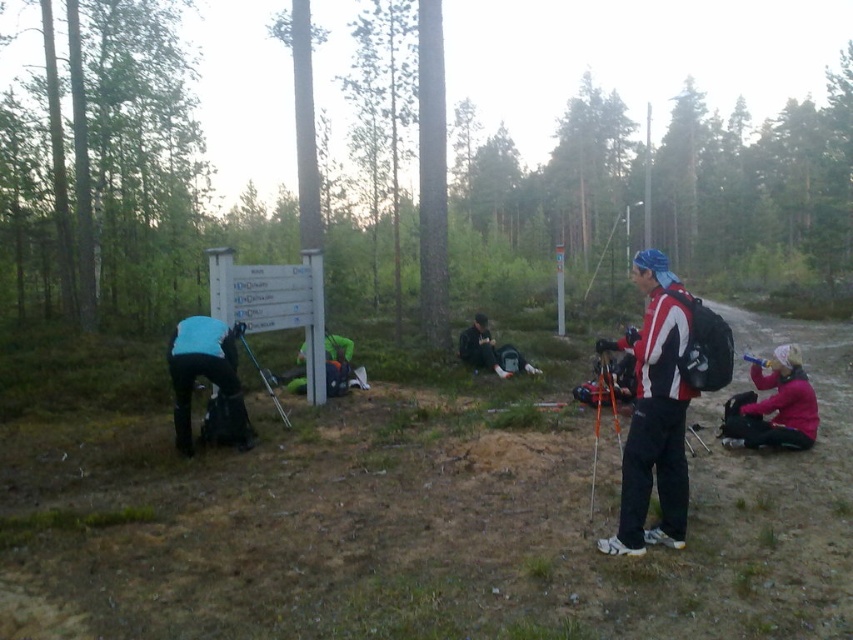
Question: Which of these objects is positioned closest to the metallic silver ski pole at lower center?

Choices:
 (A) pink fleece jacket at lower right
 (B) neon green jacket at center
 (C) red and white ski jacket at right
 (D) blue fabric skier at left

Answer: (D)

Question: Observing the image, what is the correct spatial positioning of neon green jacket at center in reference to metallic silver ski pole at lower center?

Choices:
 (A) above
 (B) below

Answer: (A)

Question: Does green grass at center come in front of blue fabric skier at left?

Choices:
 (A) no
 (B) yes

Answer: (A)

Question: Which object appears farthest from the camera in this image?

Choices:
 (A) neon green jacket at center
 (B) green grass at center

Answer: (B)

Question: Which point is closer to the camera?

Choices:
 (A) green grass at center
 (B) pink fleece jacket at lower right
 (C) neon green jacket at center

Answer: (B)

Question: Is the position of green grass at center more distant than that of blue fabric skier at left?

Choices:
 (A) yes
 (B) no

Answer: (A)